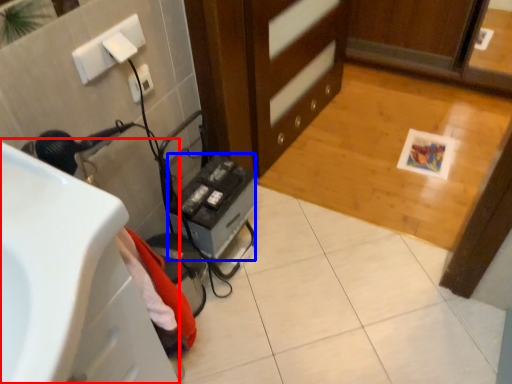
Question: Which point is closer to the camera, sink (highlighted by a red box) or appliance (highlighted by a blue box)?

Choices:
 (A) sink
 (B) appliance

Answer: (A)